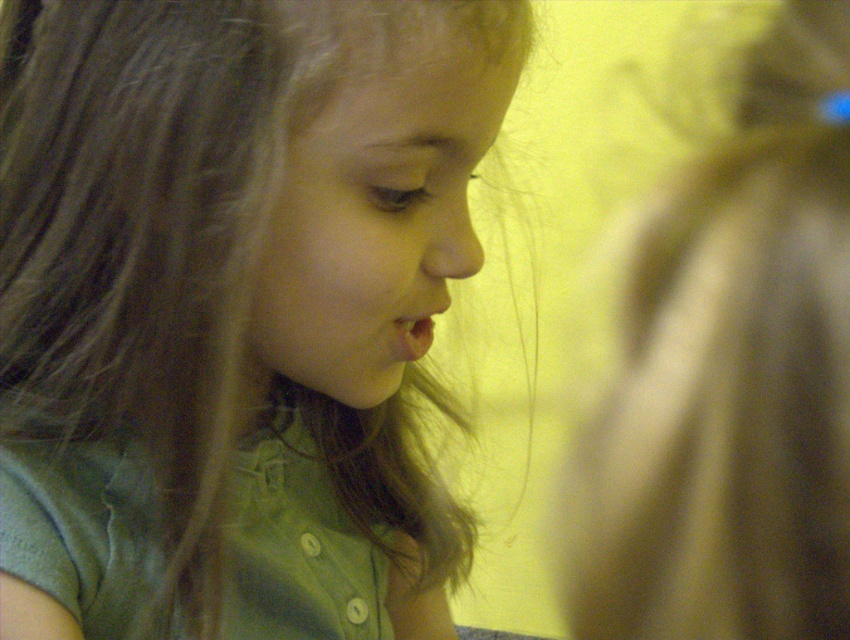
Question: Which object appears closest to the camera in this image?

Choices:
 (A) brown silky hair at upper right
 (B) brown smooth hair at center

Answer: (A)

Question: Is the position of brown smooth hair at center less distant than that of brown silky hair at upper right?

Choices:
 (A) yes
 (B) no

Answer: (B)

Question: Does brown smooth hair at center appear on the left side of brown silky hair at upper right?

Choices:
 (A) yes
 (B) no

Answer: (A)

Question: Is brown smooth hair at center bigger than brown silky hair at upper right?

Choices:
 (A) no
 (B) yes

Answer: (B)

Question: Which object appears closest to the camera in this image?

Choices:
 (A) brown smooth hair at center
 (B) brown silky hair at upper right

Answer: (B)

Question: Which point is farther to the camera?

Choices:
 (A) (69, 500)
 (B) (622, 536)

Answer: (A)